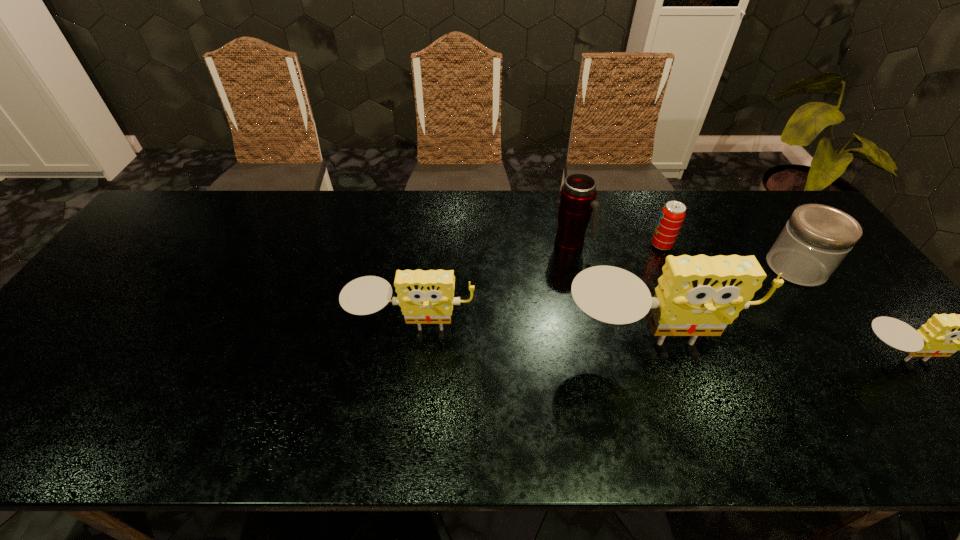
At what (x,y) coordinates should I click in order to perform the action: click on free space located on the left of the jar. Please return your answer as a coordinate pair (x, y). The height and width of the screenshot is (540, 960). Looking at the image, I should click on (706, 267).

This screenshot has height=540, width=960. I want to click on vacant space located 0.080m on the side with the handle of the thermos bottle, so click(615, 245).

Locate an element on the screen. The image size is (960, 540). object situated at the far edge is located at coordinates (577, 199).

Image resolution: width=960 pixels, height=540 pixels. What are the coordinates of `object that is at the near edge` in the screenshot? It's located at (699, 295).

Locate an element on the screen. This screenshot has height=540, width=960. object that is at the right edge is located at coordinates (815, 240).

In the image, there is a desktop. Where is `vacant space at the far edge`? The image size is (960, 540). vacant space at the far edge is located at coordinates (540, 226).

Locate an element on the screen. The width and height of the screenshot is (960, 540). vacant space at the near edge of the desktop is located at coordinates (680, 381).

Where is `blank space at the left edge of the desktop`? The image size is (960, 540). blank space at the left edge of the desktop is located at coordinates (84, 362).

At what (x,y) coordinates should I click in order to perform the action: click on free point at the right edge. Please return your answer as a coordinate pair (x, y). The width and height of the screenshot is (960, 540). Looking at the image, I should click on (850, 275).

In order to click on vacant area at the far left corner in this screenshot , I will do `click(177, 213)`.